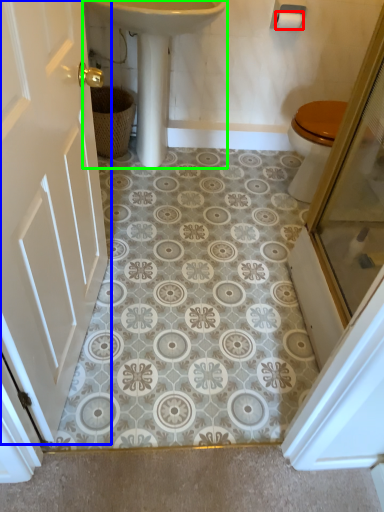
Question: Which is nearer to the toilet paper (highlighted by a red box)? door (highlighted by a blue box) or sink (highlighted by a green box).

Choices:
 (A) door
 (B) sink

Answer: (B)